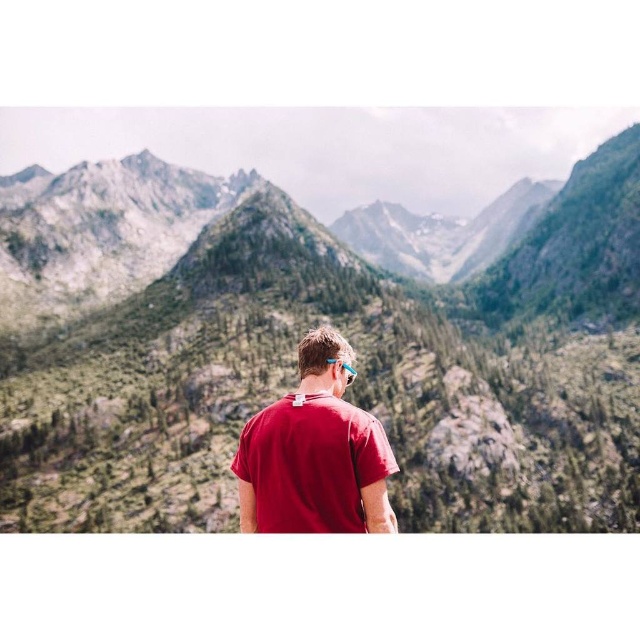
Is green textured mountains at center bigger than blue rubber goggles at center?

Yes.

Is point (108, 280) closer to camera compared to point (348, 384)?

No, it is behind (348, 384).

This screenshot has height=640, width=640. Identify the location of green textured mountains at center. (339, 328).

Does point (385, 504) lie behind point (348, 380)?

No, (385, 504) is closer to viewer.

Who is more distant from viewer, (314, 420) or (342, 364)?

The point (342, 364) is behind.

Locate an element on the screen. matte red t-shirt at center is located at coordinates (314, 454).

Is green textured mountains at center bigger than matte red t-shirt at center?

Yes, green textured mountains at center is bigger than matte red t-shirt at center.

Is green textured mountains at center in front of matte red t-shirt at center?

No, it is not.

You are a GUI agent. You are given a task and a screenshot of the screen. Output one action in this format:
    pyautogui.click(x=<x>, y=<y>)
    Task: Click on the green textured mountains at center
    The height and width of the screenshot is (640, 640).
    Given the screenshot: What is the action you would take?
    pyautogui.click(x=339, y=328)